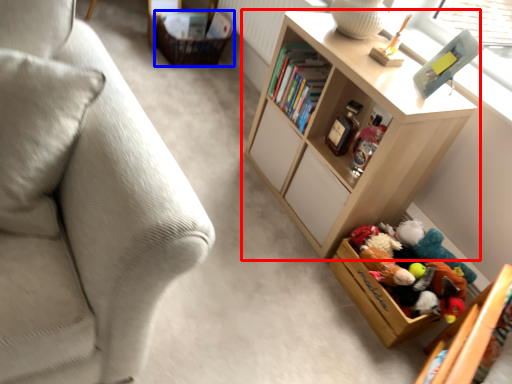
Question: Which object is further to the camera taking this photo, shelf (highlighted by a red box) or storage box (highlighted by a blue box)?

Choices:
 (A) shelf
 (B) storage box

Answer: (B)